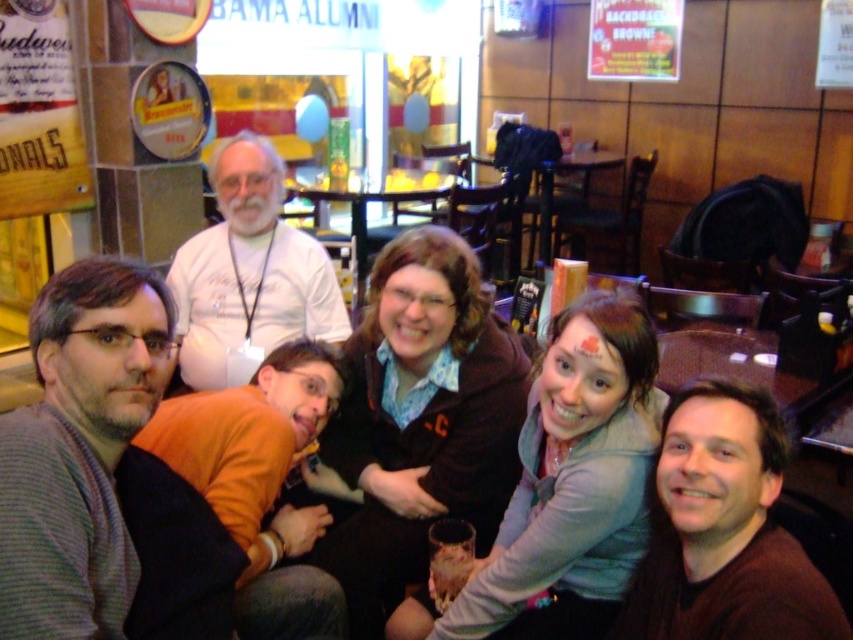
Question: Can you confirm if brown soft sweater at lower right is positioned below orange fleece at lower left?

Choices:
 (A) yes
 (B) no

Answer: (A)

Question: Does matte black jacket at center appear over white t-shirt at upper left?

Choices:
 (A) yes
 (B) no

Answer: (B)

Question: Estimate the real-world distances between objects in this image. Which object is closer to the gray striped sweater at left?

Choices:
 (A) brown soft sweater at lower right
 (B) orange fleece at lower left
 (C) matte black jacket at center
 (D) white t-shirt at upper left

Answer: (B)

Question: Among these objects, which one is nearest to the camera?

Choices:
 (A) brown soft sweater at lower right
 (B) light gray sweater at center
 (C) orange fleece at lower left
 (D) white t-shirt at upper left

Answer: (A)

Question: Which object is the farthest from the orange fleece at lower left?

Choices:
 (A) brown soft sweater at lower right
 (B) gray striped sweater at left

Answer: (A)

Question: Does light gray sweater at center have a lesser width compared to white t-shirt at upper left?

Choices:
 (A) yes
 (B) no

Answer: (A)